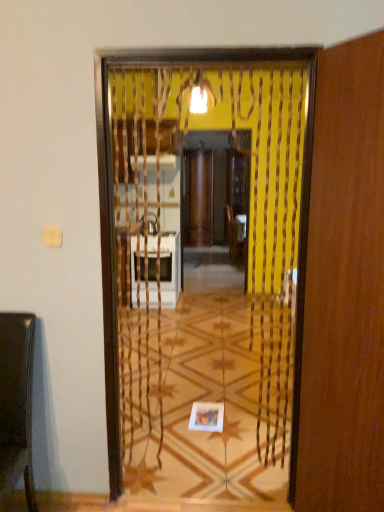
Question: From the image's perspective, is wooden screen door at center, acting as the 1th screen door starting from the back, located above or below shiny brown chair at left?

Choices:
 (A) below
 (B) above

Answer: (B)

Question: Looking at their shapes, would you say wooden screen door at center, the 2th screen door when ordered from front to back, is wider or thinner than shiny brown chair at left?

Choices:
 (A) thin
 (B) wide

Answer: (A)

Question: Which object is the closest to the shiny brown chair at left?

Choices:
 (A) wooden screen door at right, positioned as the second screen door in back-to-front order
 (B) wooden screen door at center, acting as the 1th screen door starting from the back

Answer: (A)

Question: Considering the real-world distances, which object is farthest from the wooden screen door at center, acting as the 1th screen door starting from the back?

Choices:
 (A) shiny brown chair at left
 (B) wooden screen door at right, which is the 1th screen door from front to back

Answer: (B)